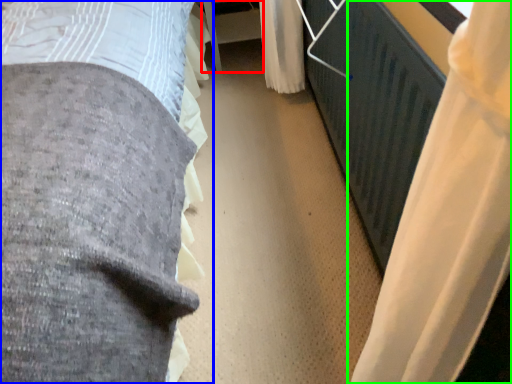
Question: Which object is positioned farthest from table (highlighted by a red box)? Select from bed (highlighted by a blue box) and curtain (highlighted by a green box).

Choices:
 (A) bed
 (B) curtain

Answer: (B)